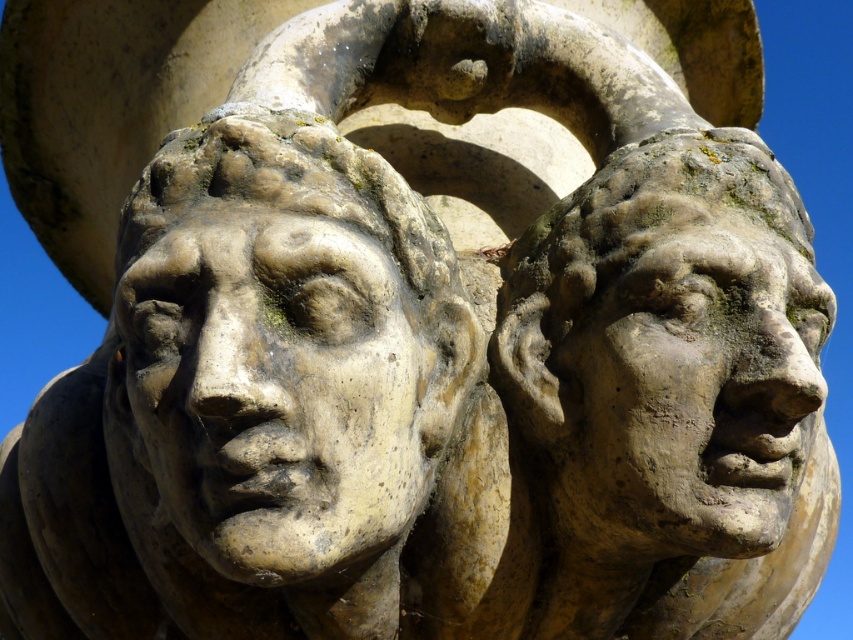
You are an art conservator examining two stone faces in a closeup view. You need to determine which face is nearer to you. The faces are the stone textured face at center and the matte stone face at right. Based on their positions, which one is closer?

The stone textured face at center is closer to the viewer than the matte stone face at right.

You are an art conservator examining two stone faces in a sculpture. The stone textured face at center and the matte stone face at right are part of the same artwork. Based on their positions and textures, which face is taller?

The stone textured face at center is taller than the matte stone face at right.

You are an architect examining the two points on the sculpted faces. Which point is closer to you, point (x=303, y=284) or point (x=692, y=234)?

Point (x=303, y=284) is in front of point (x=692, y=234), so it is closer to you.